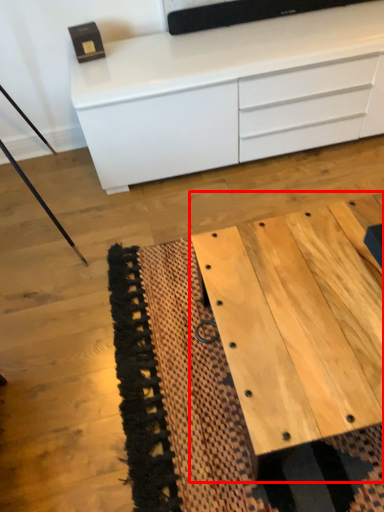
Question: Observing the image, what is the correct spatial positioning of table (annotated by the red box) in reference to chest of drawers?

Choices:
 (A) left
 (B) right

Answer: (B)